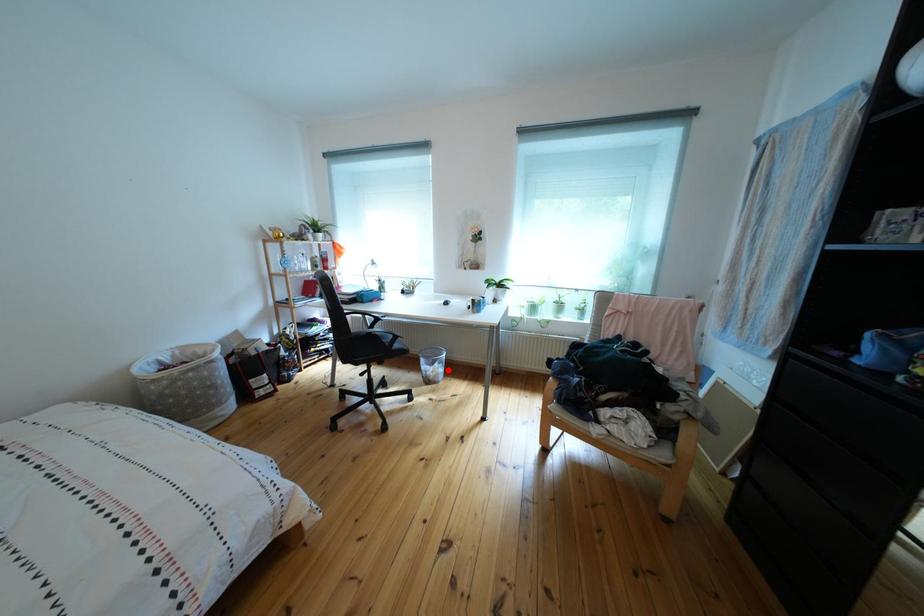
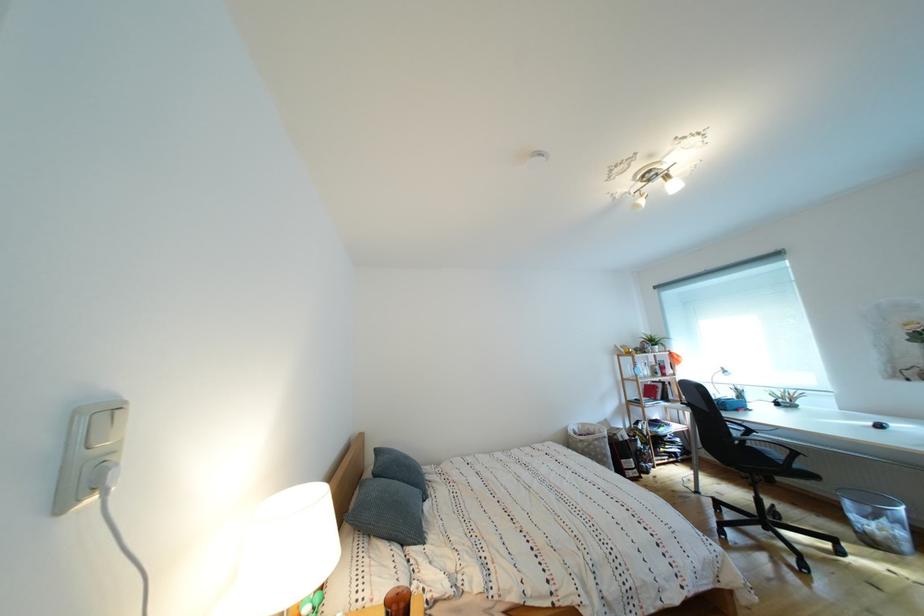
Find the pixel in the second image that matches the highlighted location in the first image.

(896, 527)